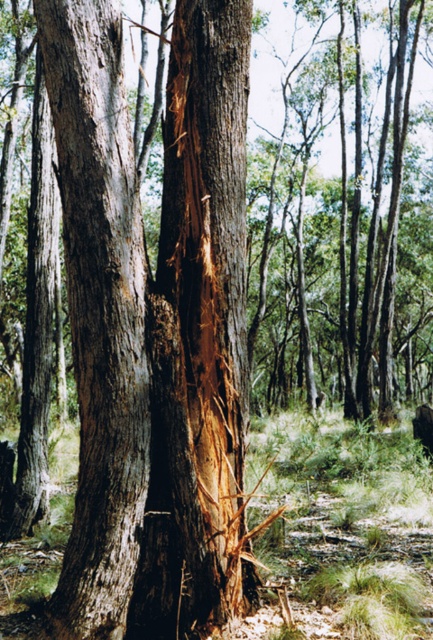
Who is positioned more to the right, brown rough bark tree trunk at center or smooth brown bark at center?

brown rough bark tree trunk at center

Is point (238, 365) more distant than point (107, 122)?

Yes, it is.

Image resolution: width=433 pixels, height=640 pixels. In order to click on brown rough bark tree trunk at center in this screenshot , I will do `click(199, 337)`.

Where is `brown rough bark tree trunk at center`? Image resolution: width=433 pixels, height=640 pixels. brown rough bark tree trunk at center is located at coordinates (199, 337).